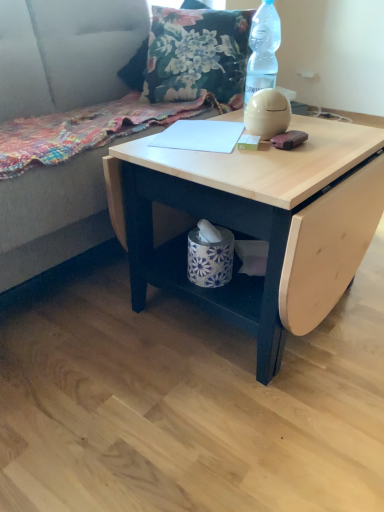
What is the approximate height of transparent plastic bottle at upper right?

It is 13.89 inches.

This screenshot has width=384, height=512. Describe the element at coordinates (263, 50) in the screenshot. I see `transparent plastic bottle at upper right` at that location.

Describe the element at coordinates (51, 216) in the screenshot. I see `suede gray couch at upper left` at that location.

Where is `suede gray couch at upper left`? The height and width of the screenshot is (512, 384). suede gray couch at upper left is located at coordinates (51, 216).

What do you see at coordinates (200, 136) in the screenshot?
I see `white paper at center` at bounding box center [200, 136].

Locate an element on the screen. This screenshot has width=384, height=512. light wood table at center is located at coordinates (254, 223).

The width and height of the screenshot is (384, 512). What are the coordinates of `transparent plastic bottle at upper right` in the screenshot? It's located at (263, 50).

From a real-world perspective, is light wood table at center physically located above or below white paper at center?

Clearly, from a real-world perspective, light wood table at center is below white paper at center.

From the image's perspective, is light wood table at center on top of white paper at center?

No.

Does light wood table at center appear on the left side of white paper at center?

In fact, light wood table at center is to the right of white paper at center.

Is light wood table at center bigger or smaller than white paper at center?

In the image, light wood table at center appears to be larger than white paper at center.

You are a GUI agent. You are given a task and a screenshot of the screen. Output one action in this format:
    pyautogui.click(x=<x>, y=<y>)
    Task: Click on the throw pillow on the right of the suede gray couch at upper left
    The width and height of the screenshot is (384, 512).
    Given the screenshot: What is the action you would take?
    pyautogui.click(x=196, y=54)

From a real-world perspective, which is physically below, floral fabric pillow at upper center or suede gray couch at upper left?

In real-world perspective, suede gray couch at upper left is lower.

Between floral fabric pillow at upper center and suede gray couch at upper left, which one appears on the left side from the viewer's perspective?

Result: From the viewer's perspective, suede gray couch at upper left appears more on the left side.

Between point (280, 217) and point (41, 101), which one is positioned in front?

The point (280, 217) is in front.

Considering the relative sizes of light wood table at center and suede gray couch at upper left in the image provided, is light wood table at center bigger than suede gray couch at upper left?

Incorrect, light wood table at center is not larger than suede gray couch at upper left.

Can you confirm if light wood table at center is wider than suede gray couch at upper left?

Incorrect, the width of light wood table at center does not surpass that of suede gray couch at upper left.

Would you consider light wood table at center to be distant from suede gray couch at upper left?

That's right, there is a large distance between light wood table at center and suede gray couch at upper left.

Does transparent plastic bottle at upper right have a greater width compared to white paper at center?

Incorrect, the width of transparent plastic bottle at upper right does not surpass that of white paper at center.

From their relative heights in the image, would you say transparent plastic bottle at upper right is taller or shorter than white paper at center?

In the image, transparent plastic bottle at upper right appears to be taller than white paper at center.

Is transparent plastic bottle at upper right touching white paper at center?

They are not placed beside each other.

From a real-world perspective, is transparent plastic bottle at upper right above or below white paper at center?

transparent plastic bottle at upper right is situated higher than white paper at center in the real world.

Can you confirm if floral fabric pillow at upper center is thinner than light wood table at center?

Indeed, floral fabric pillow at upper center has a lesser width compared to light wood table at center.

Is floral fabric pillow at upper center closer to the viewer compared to light wood table at center?

No, floral fabric pillow at upper center is further to the viewer.

Between floral fabric pillow at upper center and light wood table at center, which one has less height?

floral fabric pillow at upper center is shorter.

Where is `throw pillow on the left of light wood table at center`? This screenshot has height=512, width=384. throw pillow on the left of light wood table at center is located at coordinates [x=196, y=54].

Which object is thinner, suede gray couch at upper left or white paper at center?

white paper at center.

Considering the sizes of objects suede gray couch at upper left and white paper at center in the image provided, who is taller, suede gray couch at upper left or white paper at center?

With more height is suede gray couch at upper left.

Is suede gray couch at upper left positioned far away from white paper at center?

No, suede gray couch at upper left is in close proximity to white paper at center.

From a real-world perspective, is light wood table at center physically above floral fabric pillow at upper center?

No.

From the image's perspective, is light wood table at center above or below floral fabric pillow at upper center?

light wood table at center is below floral fabric pillow at upper center.

Based on their sizes in the image, would you say light wood table at center is bigger or smaller than floral fabric pillow at upper center?

Clearly, light wood table at center is larger in size than floral fabric pillow at upper center.

Could you tell me if light wood table at center is facing floral fabric pillow at upper center?

No, light wood table at center is not oriented towards floral fabric pillow at upper center.

At what (x,y) coordinates should I click in order to perform the action: click on notebook that is above the light wood table at center (from the image's perspective). Please return your answer as a coordinate pair (x, y). This screenshot has height=512, width=384. Looking at the image, I should click on (200, 136).

The image size is (384, 512). In order to click on couch below the floral fabric pillow at upper center (from a real-world perspective) in this screenshot , I will do `click(51, 216)`.

Considering their positions, is light wood table at center positioned further to floral fabric pillow at upper center than transparent plastic bottle at upper right?

Based on the image, light wood table at center appears to be further to floral fabric pillow at upper center.

Considering their positions, is floral fabric pillow at upper center positioned closer to suede gray couch at upper left than light wood table at center?

floral fabric pillow at upper center.

Considering their positions, is floral fabric pillow at upper center positioned closer to transparent plastic bottle at upper right than white paper at center?

Among the two, white paper at center is located nearer to transparent plastic bottle at upper right.

From the image, which object appears to be nearer to floral fabric pillow at upper center, transparent plastic bottle at upper right or suede gray couch at upper left?

transparent plastic bottle at upper right.

Based on their spatial positions, is suede gray couch at upper left or transparent plastic bottle at upper right further from floral fabric pillow at upper center?

suede gray couch at upper left.

Looking at the image, which one is located further to white paper at center, suede gray couch at upper left or transparent plastic bottle at upper right?

suede gray couch at upper left.

Which object lies nearer to the anchor point light wood table at center, floral fabric pillow at upper center or white paper at center?

white paper at center lies closer to light wood table at center than the other object.

Based on their spatial positions, is white paper at center or floral fabric pillow at upper center closer to light wood table at center?

white paper at center is positioned closer to the anchor light wood table at center.

Identify the location of table between suede gray couch at upper left and floral fabric pillow at upper center along the z-axis. Image resolution: width=384 pixels, height=512 pixels. (254, 223).

Identify the location of notebook between suede gray couch at upper left and light wood table at center. (200, 136).

Where is `bottle located between suede gray couch at upper left and floral fabric pillow at upper center in the depth direction`? This screenshot has height=512, width=384. bottle located between suede gray couch at upper left and floral fabric pillow at upper center in the depth direction is located at coordinates (263, 50).

Identify the location of notebook between suede gray couch at upper left and floral fabric pillow at upper center in the front-back direction. (200, 136).